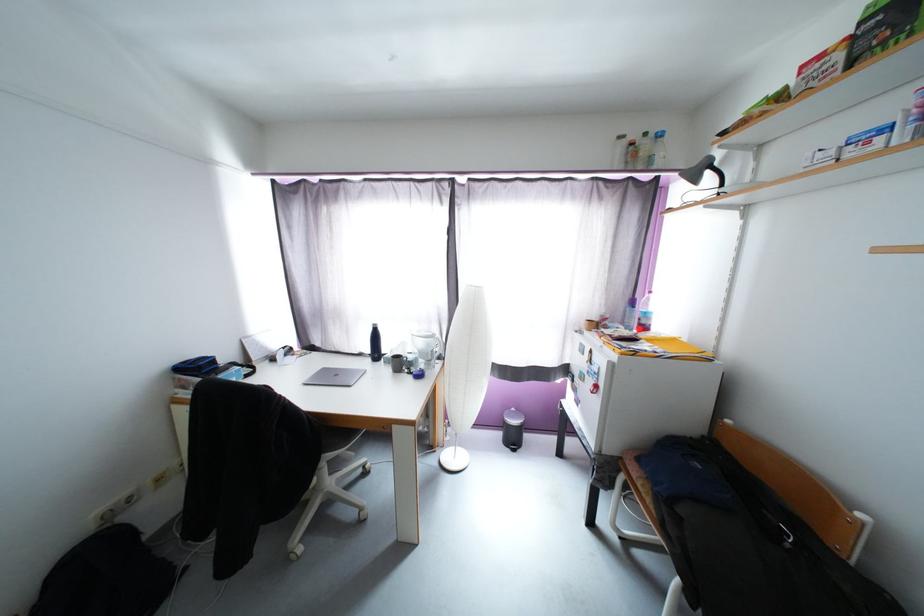
The location [643,313] corresponds to which object?

This point indicates the red top bottle.